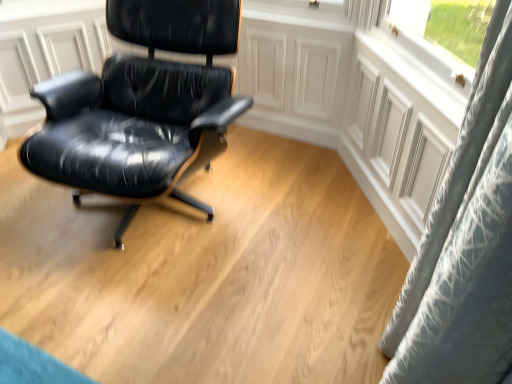
Question: Does point (120, 77) appear closer or farther from the camera than point (446, 205)?

Choices:
 (A) closer
 (B) farther

Answer: (B)

Question: Relative to blue textured curtain at upper right, is glossy black leather chair at center in front or behind?

Choices:
 (A) front
 (B) behind

Answer: (A)

Question: Is glossy black leather chair at center wider or thinner than blue textured curtain at upper right?

Choices:
 (A) wide
 (B) thin

Answer: (A)

Question: Is blue textured curtain at upper right inside the boundaries of glossy black leather chair at center, or outside?

Choices:
 (A) outside
 (B) inside

Answer: (A)

Question: From a real-world perspective, is blue textured curtain at upper right above or below glossy black leather chair at center?

Choices:
 (A) above
 (B) below

Answer: (B)

Question: Considering the positions of point (459, 236) and point (131, 147), is point (459, 236) closer or farther from the camera than point (131, 147)?

Choices:
 (A) farther
 (B) closer

Answer: (B)

Question: Would you say blue textured curtain at upper right is to the left or to the right of glossy black leather chair at center in the picture?

Choices:
 (A) right
 (B) left

Answer: (A)